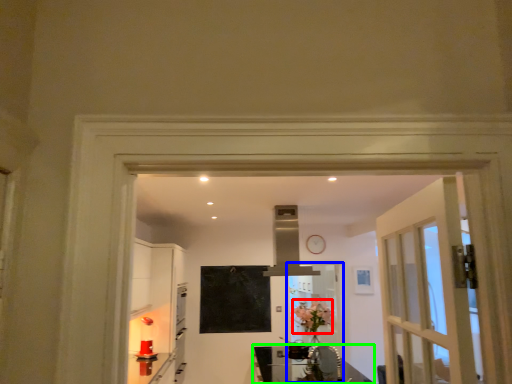
Question: Considering the real-world distances, which object is closest to flower (highlighted by a red box)? screen door (highlighted by a blue box) or table (highlighted by a green box).

Choices:
 (A) screen door
 (B) table

Answer: (A)